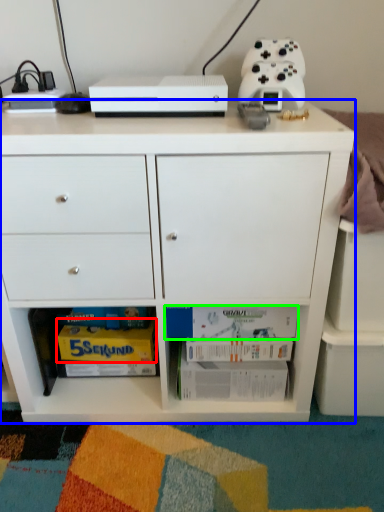
Question: Which object is the closest to the magazine (highlighted by a red box)? Choose among these: chest of drawers (highlighted by a blue box) or book (highlighted by a green box).

Choices:
 (A) chest of drawers
 (B) book

Answer: (B)